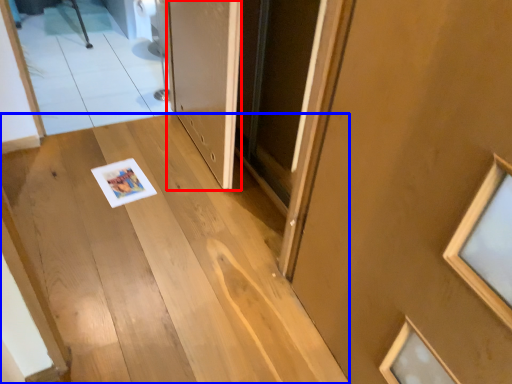
Question: Which point is closer to the camera, door (highlighted by a red box) or stairs (highlighted by a blue box)?

Choices:
 (A) door
 (B) stairs

Answer: (B)